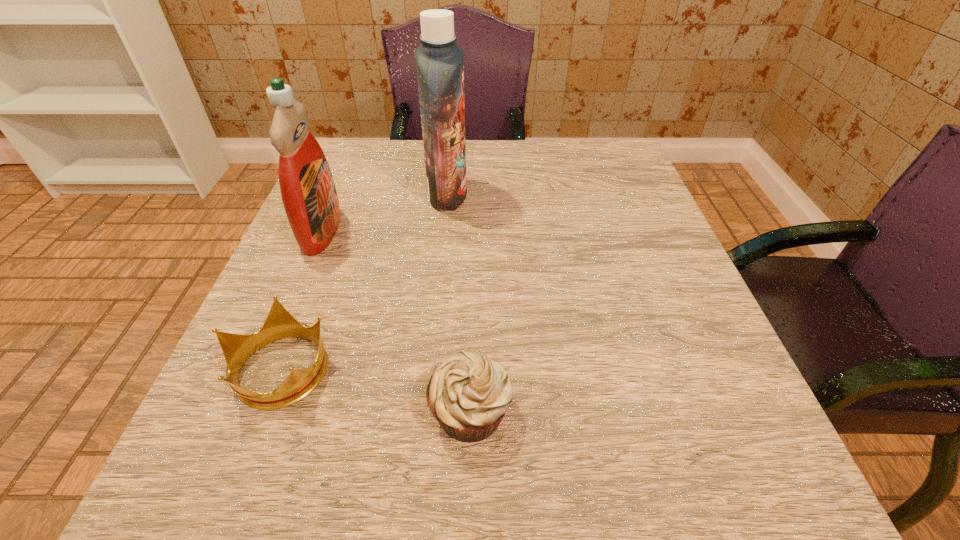
Find the location of a particular element. The image size is (960, 540). vacant area in the image that satisfies the following two spatial constraints: 1. on the front label of the shampoo; 2. on the left side of the muffin is located at coordinates (427, 411).

This screenshot has height=540, width=960. I want to click on free space in the image that satisfies the following two spatial constraints: 1. on the front surface of the second tallest object; 2. on the right side of the muffin, so click(x=247, y=411).

The width and height of the screenshot is (960, 540). I want to click on vacant region that satisfies the following two spatial constraints: 1. on the front surface of the detergent; 2. on the back side of the crown, so (264, 368).

Locate an element on the screen. vacant region that satisfies the following two spatial constraints: 1. on the front label of the tallest object; 2. on the back side of the muffin is located at coordinates (427, 411).

This screenshot has width=960, height=540. Identify the location of vacant space that satisfies the following two spatial constraints: 1. on the front surface of the muffin; 2. on the right side of the third shortest object. (247, 411).

I want to click on vacant area that satisfies the following two spatial constraints: 1. on the front label of the shampoo; 2. on the left side of the muffin, so click(427, 411).

At what (x,y) coordinates should I click in order to perform the action: click on free region that satisfies the following two spatial constraints: 1. on the front side of the crown; 2. on the left side of the muffin. Please return your answer as a coordinate pair (x, y). The height and width of the screenshot is (540, 960). Looking at the image, I should click on (264, 411).

The width and height of the screenshot is (960, 540). Identify the location of free space that satisfies the following two spatial constraints: 1. on the front label of the shampoo; 2. on the front side of the crown. (431, 368).

Find the location of a particular element. This screenshot has height=540, width=960. vacant region that satisfies the following two spatial constraints: 1. on the front surface of the second tallest object; 2. on the back side of the crown is located at coordinates (264, 368).